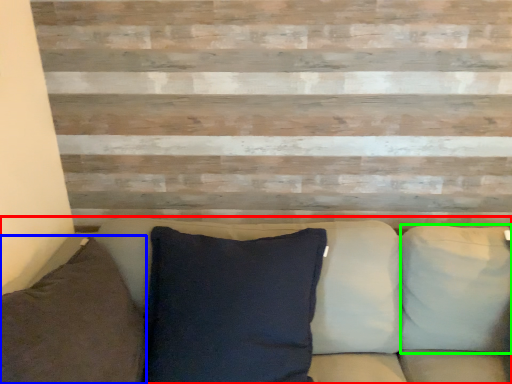
Question: Which object is the farthest from studio couch (highlighted by a red box)? Choose among these: pillow (highlighted by a blue box) or pillow (highlighted by a green box).

Choices:
 (A) pillow
 (B) pillow

Answer: (A)